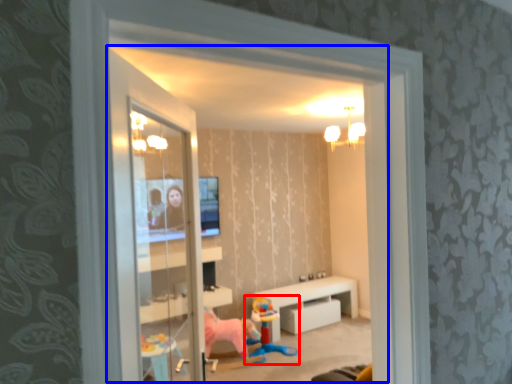
Question: Which object is further to the camera taking this photo, toy (highlighted by a red box) or window (highlighted by a blue box)?

Choices:
 (A) toy
 (B) window

Answer: (A)